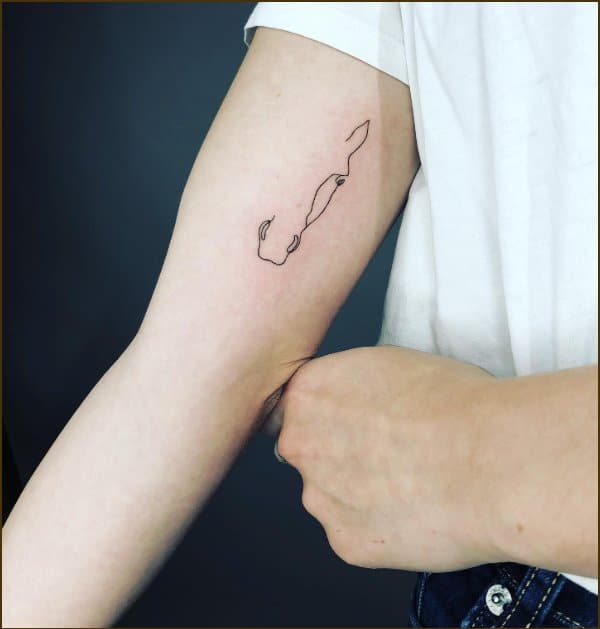
Find the location of `wall`. wall is located at coordinates (139, 141).